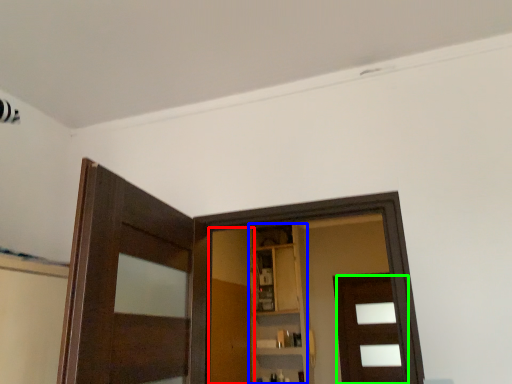
Question: Based on their relative distances, which object is nearer to barn door (highlighted by a red box)? Choose from cabinetry (highlighted by a blue box) and door (highlighted by a green box).

Choices:
 (A) cabinetry
 (B) door

Answer: (A)